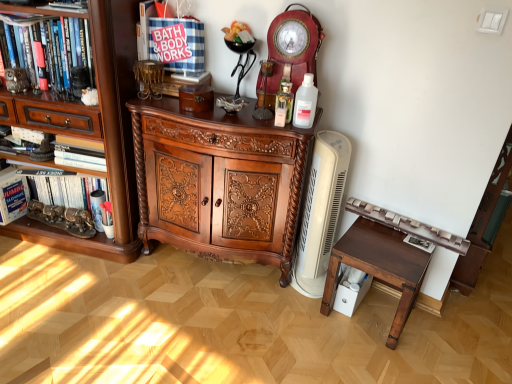
You are a GUI agent. You are given a task and a screenshot of the screen. Output one action in this format:
    pyautogui.click(x=<x>, y=<y>)
    Task: Click on the vacant space that is to the left of dark brown wooden table at right
    This screenshot has width=512, height=384.
    Given the screenshot: What is the action you would take?
    pyautogui.click(x=300, y=319)